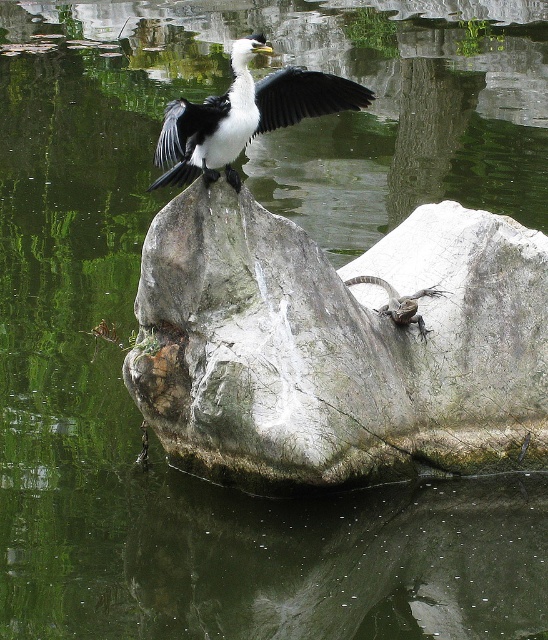
You are standing at the edge of the pond and want to place a small pebble on the rock where the bird is perched. The coordinates for the bird are point (288, 276) and the lizard is at point (222, 134). Which point should you aim for to place the pebble near the bird?

You should aim for point (288, 276) because that is where the bird is perched on the rock.